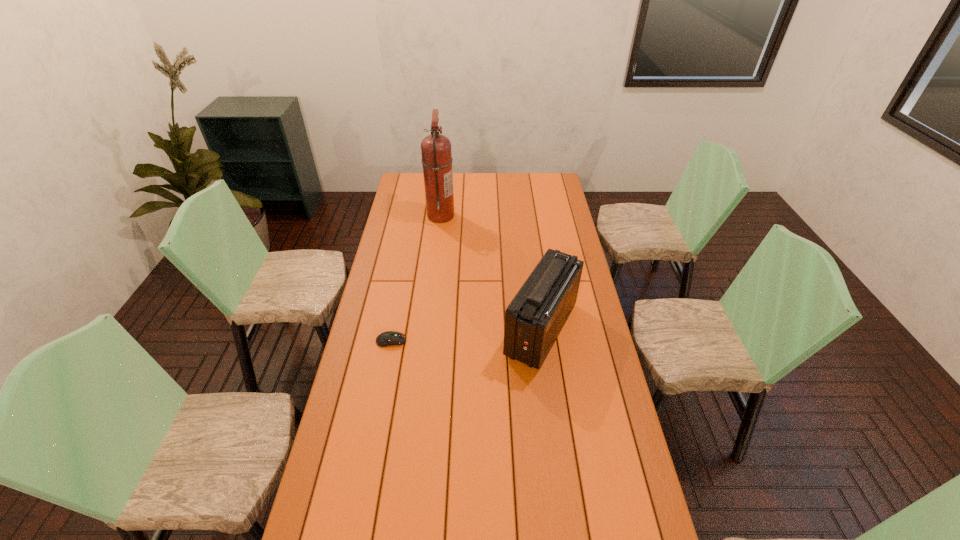
At what (x,y) coordinates should I click in order to perform the action: click on vacant region located on the button of the computer equipment. Please return your answer as a coordinate pair (x, y). The image size is (960, 540). Looking at the image, I should click on (510, 341).

Find the location of a particular element. This screenshot has width=960, height=540. object that is at the left edge is located at coordinates (389, 338).

The height and width of the screenshot is (540, 960). I want to click on object present at the right edge, so click(x=533, y=320).

This screenshot has height=540, width=960. I want to click on free space at the far edge of the desktop, so click(475, 174).

At what (x,y) coordinates should I click in order to perform the action: click on blank area at the left edge. Please return your answer as a coordinate pair (x, y). Looking at the image, I should click on (362, 483).

At what (x,y) coordinates should I click in order to perform the action: click on vacant space at the right edge of the desktop. Please return your answer as a coordinate pair (x, y). Image resolution: width=960 pixels, height=540 pixels. Looking at the image, I should click on (578, 390).

Locate an element on the screen. The image size is (960, 540). free space between the leftmost object and the tallest object is located at coordinates (416, 278).

The image size is (960, 540). I want to click on vacant space that's between the radio receiver and the tallest object, so click(x=492, y=272).

The width and height of the screenshot is (960, 540). What are the coordinates of `free space that is in between the shortest object and the rightmost object` in the screenshot? It's located at (466, 335).

Find the location of a particular element. The image size is (960, 540). empty space between the second tallest object and the fire extinguisher is located at coordinates (492, 272).